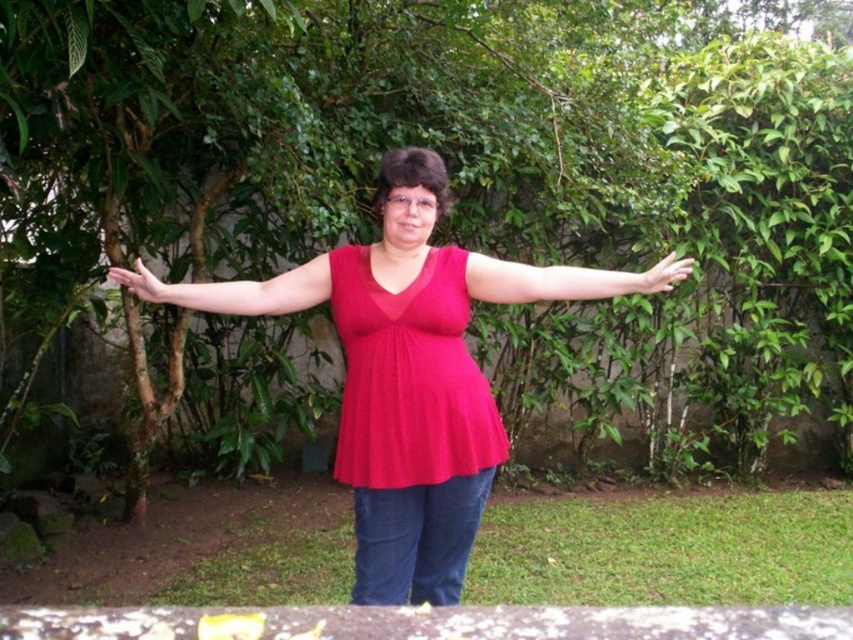
In order to click on matte red hand at left in this screenshot , I will do `click(142, 284)`.

Where is `matte red hand at left`? matte red hand at left is located at coordinates (142, 284).

Which is behind, point (590, 298) or point (680, 276)?

Positioned behind is point (680, 276).

Identify the location of matte red shirt at center. Image resolution: width=853 pixels, height=640 pixels. (564, 280).

Is matte red sleeve at center smaller than matte red hand at left?

Actually, matte red sleeve at center might be larger than matte red hand at left.

Is matte red sleeve at center behind matte red hand at left?

No, matte red sleeve at center is closer to the viewer.

Who is more forward, (302, 268) or (119, 273)?

Point (119, 273) is in front.

Where is `matte red sleeve at center`? This screenshot has width=853, height=640. matte red sleeve at center is located at coordinates (234, 291).